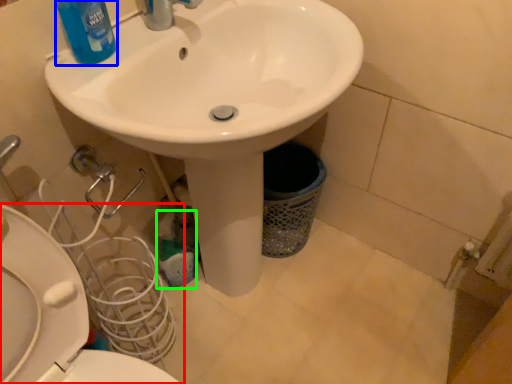
Question: Which object is positioned closest to toilet (highlighted by a red box)? Select from cleaning product (highlighted by a blue box) and cleaning product (highlighted by a green box).

Choices:
 (A) cleaning product
 (B) cleaning product

Answer: (A)